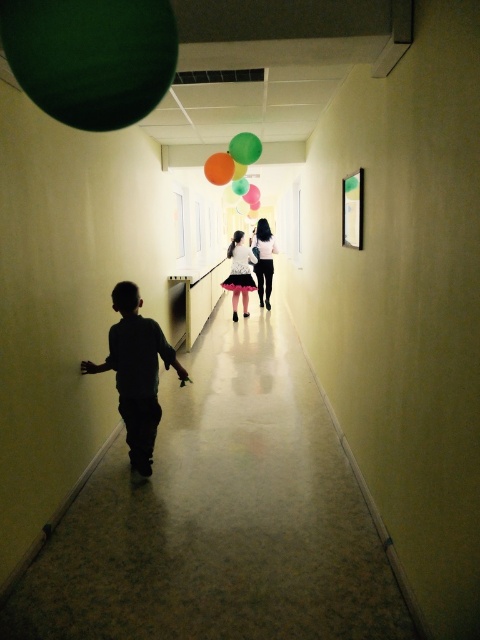
You are standing at the entrance of the hallway and see the translucent orange balloon at center. If you walk straight ahead, will the balloon remain in your line of sight until you reach the end of the hallway?

The translucent orange balloon at center is positioned at point (228, 161), so yes, it will stay in your line of sight as you walk straight ahead towards the end of the hallway.

You are a child holding a translucent orange balloon at center and a green matte balloon at center. You want to place them on a shelf that can only hold items up to 1 meter tall. Which balloon should you choose to fit on the shelf?

The green matte balloon at center should be chosen because it is shorter than the translucent orange balloon at center, which is taller than 1 meter.

Based on the photo, you are a delivery person in the hallway and need to place a new green matte balloon at center and green matte balloon at upper center. According to the scene, where should you position the second balloon relative to the first one?

The green matte balloon at upper center should be placed behind the green matte balloon at center since the green matte balloon at center is in front of it.